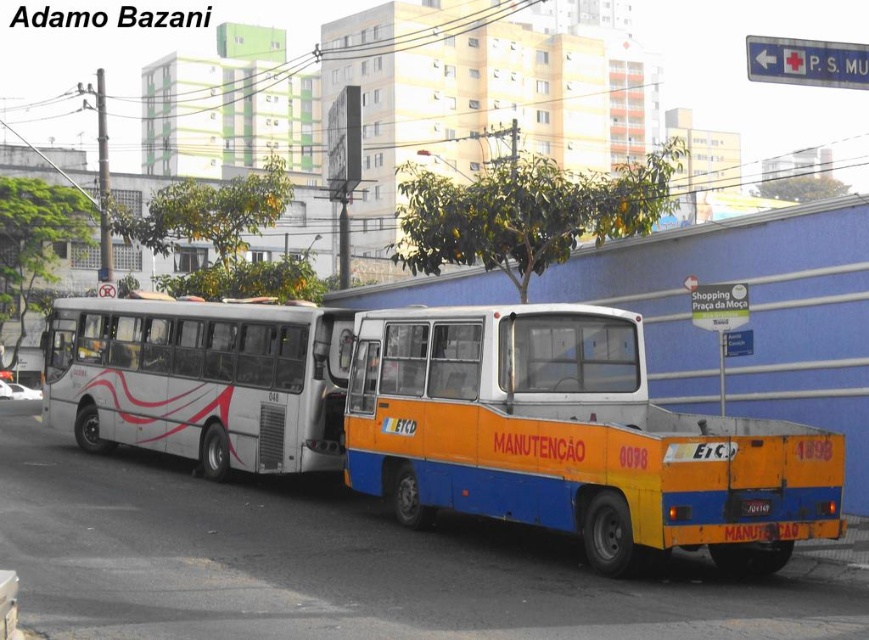
You are a pedestrian standing on the sidewalk and see both the yellow matte bus at center and the white glossy bus at center. Which bus is closer to the ground?

The yellow matte bus at center is located below the white glossy bus at center, so it is closer to the ground.

You are standing on the sidewalk and see two buses parked side by side. The first bus is the standard public transport vehicle on the left, and the second is the smaller yellow bus with blue and orange stripes on the right. If you want to locate the point at coordinates (572, 438), which bus would it be on?

The point at coordinates (572, 438) is on the yellow matte bus at center.

You are standing on the sidewalk looking at the two buses parked side by side. There are two points marked on the image. One is at coordinate point (486, 324) and the other is at coordinate point (105, 355). Which point is closer to you?

Point (486, 324) is closer to the viewer than point (105, 355).